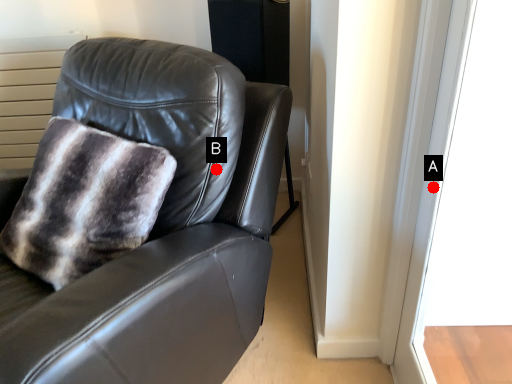
Question: Two points are circled on the image, labeled by A and B beside each circle. Among these points, which one is nearest to the camera?

Choices:
 (A) A is closer
 (B) B is closer

Answer: (A)